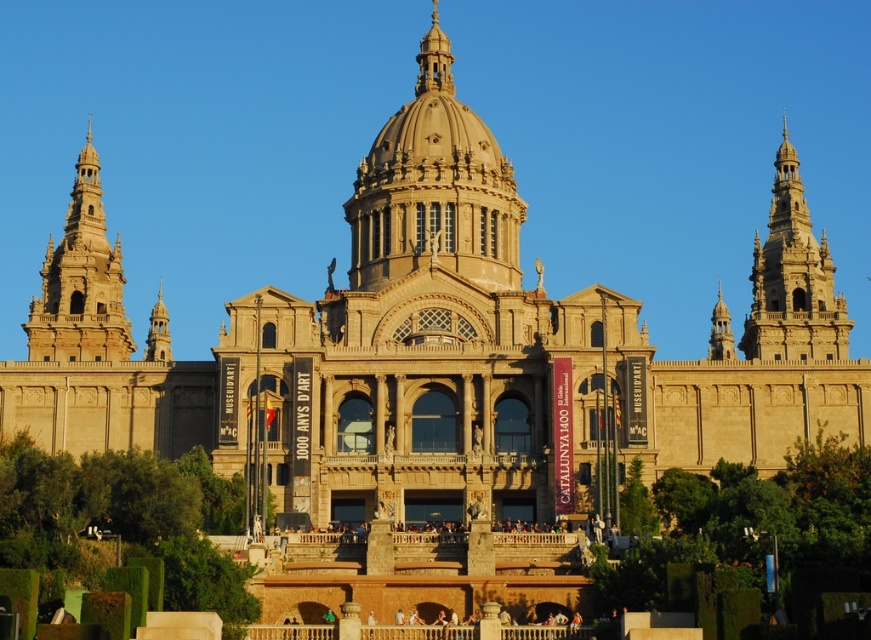
You are an architect assessing the symmetry of the building. Which golden stone tower has a smaller width between the golden stone tower at upper right and the golden stone tower at left?

The golden stone tower at upper right has a smaller width than the golden stone tower at left.

You are standing in front of the grand historic building and want to take a photo that includes both the golden stone tower at upper right and the central dome. Based on their positions, where should you position yourself to ensure both elements are in the frame?

A: To capture both the golden stone tower at upper right and the central dome in the same frame, position yourself centrally in front of the building. Since the golden stone tower at upper right is located at point (x=793, y=280), which is near the upper right corner, and the central dome is in the center, centering yourself will ensure both elements are included in the photo.

You are standing in front of the historic building and want to take a photo of both the golden stone tower at upper right and the golden stone tower at left. Which tower should you position yourself to the left of to capture both in the frame?

You should position yourself to the left of the golden stone tower at left to capture both the golden stone tower at upper right and the golden stone tower at left in the frame since the golden stone tower at upper right is on the right side of the golden stone tower at left.